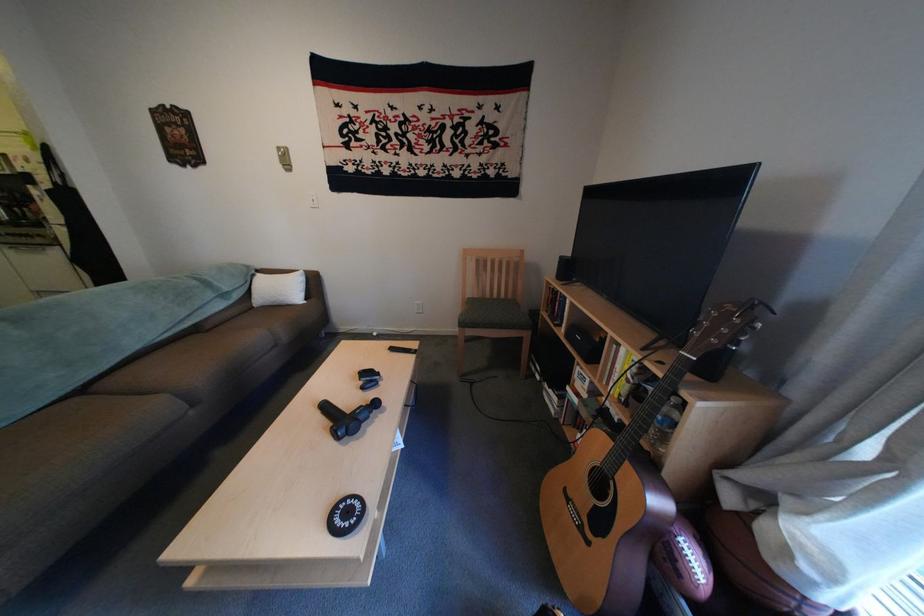
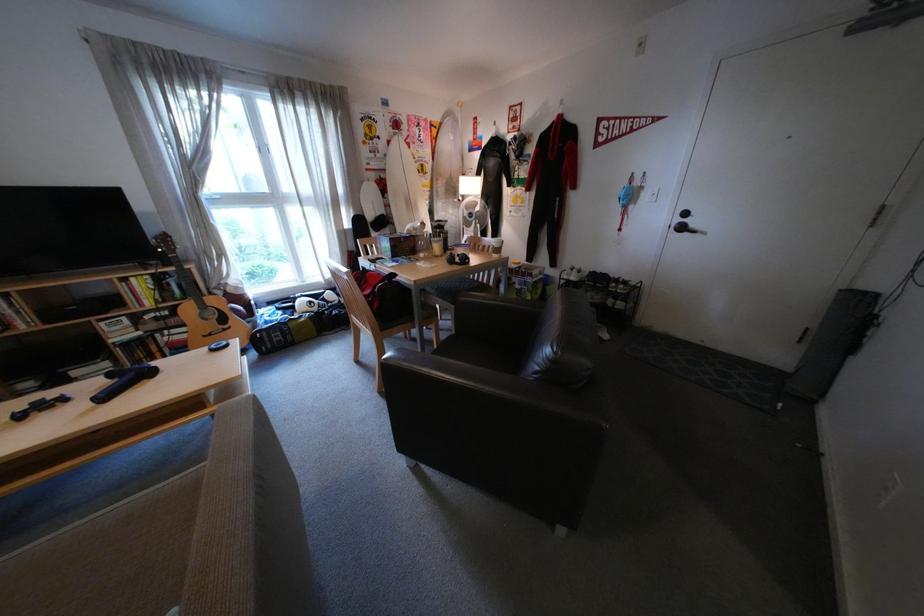
The point at (584, 495) is marked in the first image. Where is the corresponding point in the second image?

(220, 334)